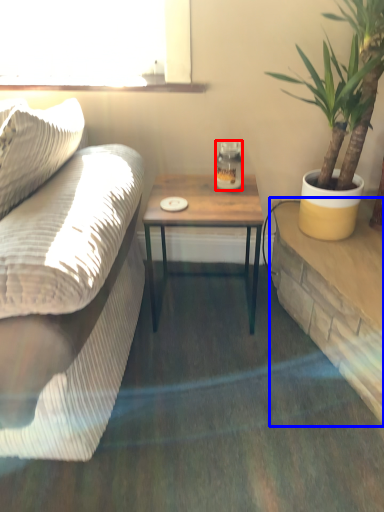
Question: Which point is further to the camera, coffee cup (highlighted by a red box) or table (highlighted by a blue box)?

Choices:
 (A) coffee cup
 (B) table

Answer: (A)